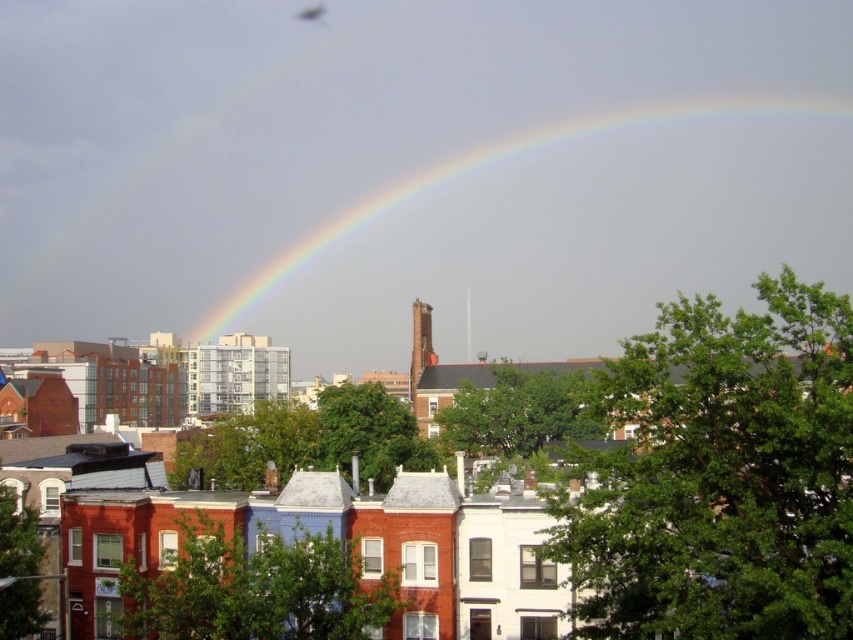
Can you confirm if rainbow at upper center is wider than translucent glass fly at upper center?

Indeed, rainbow at upper center has a greater width compared to translucent glass fly at upper center.

Is point (656, 115) positioned behind point (308, 19)?

No, (656, 115) is closer to viewer.

In order to click on rainbow at upper center in this screenshot , I will do pyautogui.click(x=502, y=157).

The height and width of the screenshot is (640, 853). In order to click on rainbow at upper center in this screenshot , I will do (x=502, y=157).